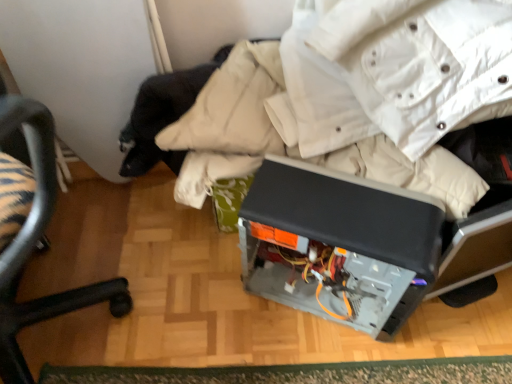
Where is `empty space that is ontop of green textured mat at lower center`? The height and width of the screenshot is (384, 512). empty space that is ontop of green textured mat at lower center is located at coordinates (286, 370).